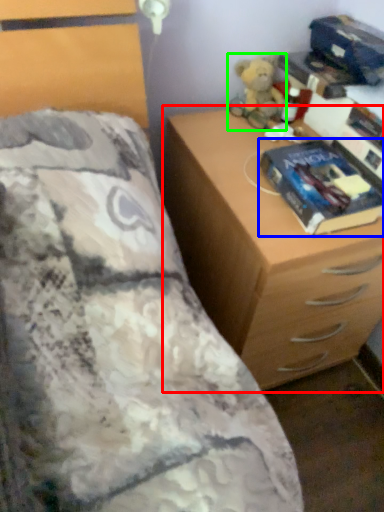
Question: Which is farther away from chest of drawers (highlighted by a red box)? paperback book (highlighted by a blue box) or toy (highlighted by a green box)?

Choices:
 (A) paperback book
 (B) toy

Answer: (B)